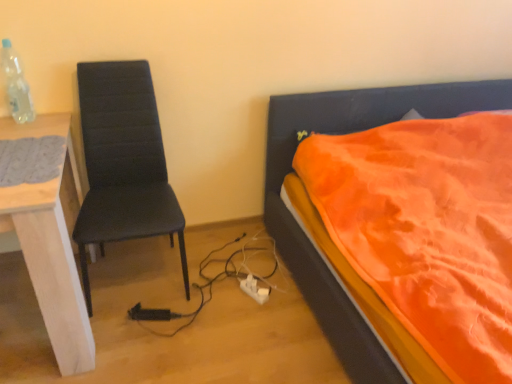
Find the location of a particular element. vacant space situated on the left part of white plastic power plugs and sockets at lower center is located at coordinates (221, 293).